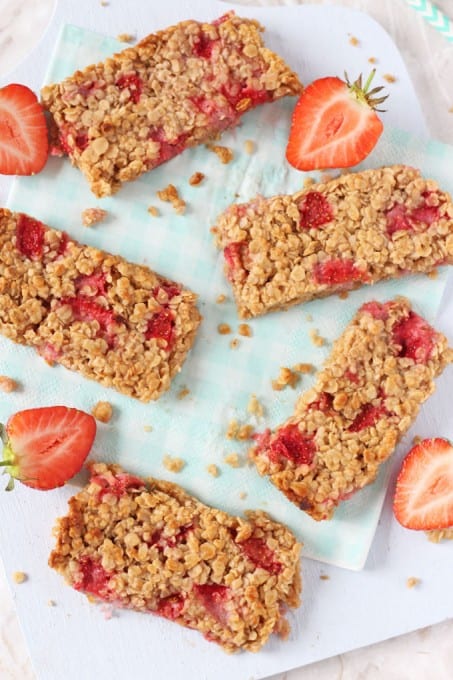
Where is `marble countertop empty space`? The width and height of the screenshot is (453, 680). marble countertop empty space is located at coordinates (438, 92), (405, 26), (13, 37), (36, 18), (16, 653), (380, 664), (437, 653).